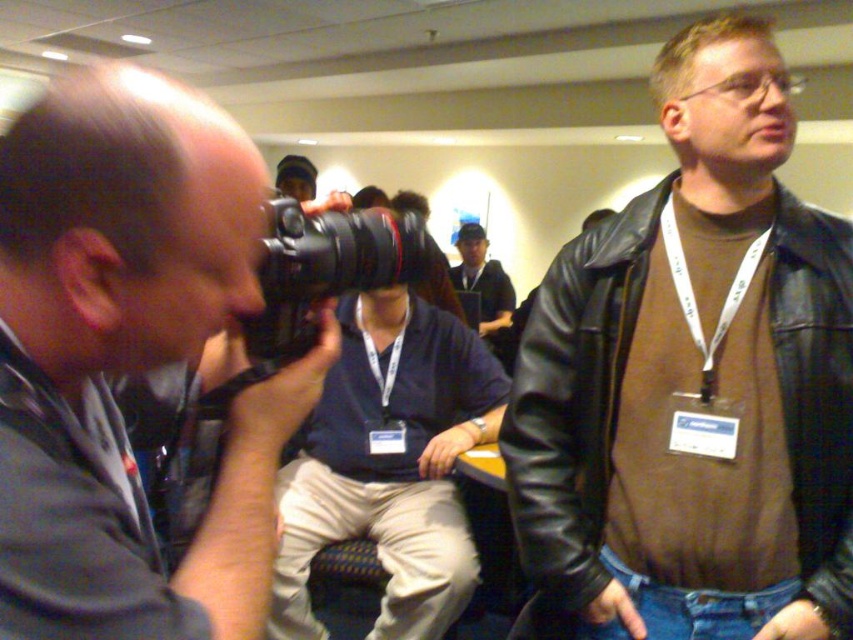
Question: Considering the relative positions of matte black camera at left and black leather jacket at upper right in the image provided, where is matte black camera at left located with respect to black leather jacket at upper right?

Choices:
 (A) below
 (B) above

Answer: (B)

Question: Which object is farther from the camera taking this photo?

Choices:
 (A) matte black camera at left
 (B) black plastic camera at center
 (C) blue fabric cap at center
 (D) black leather jacket at upper right

Answer: (C)

Question: Can you confirm if black leather jacket at upper right is wider than black plastic camera at center?

Choices:
 (A) yes
 (B) no

Answer: (A)

Question: Which of these objects is positioned closest to the blue fabric cap at center?

Choices:
 (A) blue fabric shirt at center
 (B) matte black camera at left
 (C) black leather jacket at upper right
 (D) black plastic camera at center

Answer: (A)

Question: Which of the following is the closest to the observer?

Choices:
 (A) black leather jacket at upper right
 (B) blue fabric shirt at center
 (C) matte black camera at left

Answer: (C)

Question: In this image, where is blue fabric shirt at center located relative to blue fabric cap at center?

Choices:
 (A) below
 (B) above

Answer: (A)